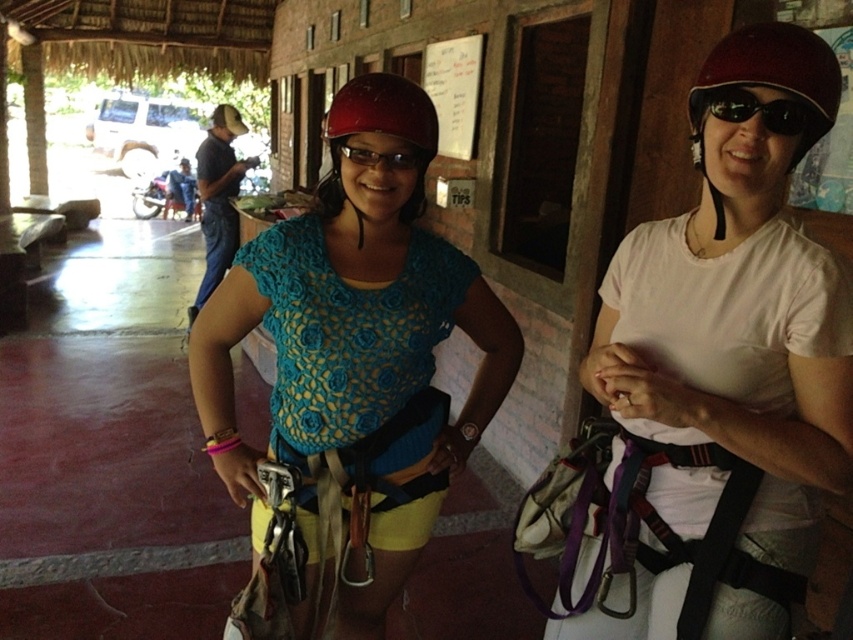
Describe the element at coordinates (730, 356) in the screenshot. The image size is (853, 640). I see `white matte helmet at center` at that location.

Which is more to the left, white matte helmet at center or white paper at upper center?

white paper at upper center is more to the left.

Locate an element on the screen. The width and height of the screenshot is (853, 640). white matte helmet at center is located at coordinates (730, 356).

Looking at this image, can you confirm if maroon matte helmet at upper right is thinner than white paper at upper center?

Correct, maroon matte helmet at upper right's width is less than white paper at upper center's.

Does maroon matte helmet at upper right have a larger size compared to white paper at upper center?

Incorrect, maroon matte helmet at upper right is not larger than white paper at upper center.

I want to click on maroon matte helmet at upper right, so click(770, 76).

Is matte blue shirt at center wider than black plastic goggles at upper right?

Correct, the width of matte blue shirt at center exceeds that of black plastic goggles at upper right.

Which is more to the left, matte blue shirt at center or black plastic goggles at upper right?

matte blue shirt at center is more to the left.

Describe the element at coordinates (354, 365) in the screenshot. The width and height of the screenshot is (853, 640). I see `matte blue shirt at center` at that location.

What are the coordinates of `matte blue shirt at center` in the screenshot? It's located at (354, 365).